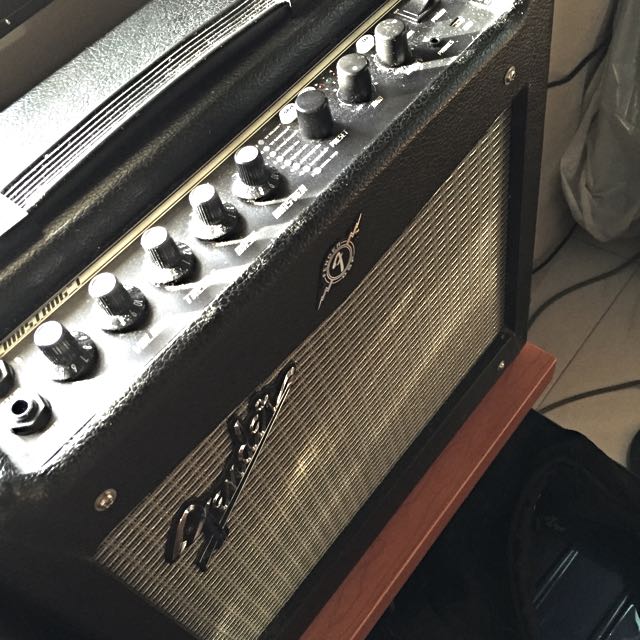
At what (x,y) coordinates should I click in order to perform the action: click on screws. Please return your answer as a coordinate pair (x, y). This screenshot has height=640, width=640. Looking at the image, I should click on (502, 363), (106, 499), (508, 74).